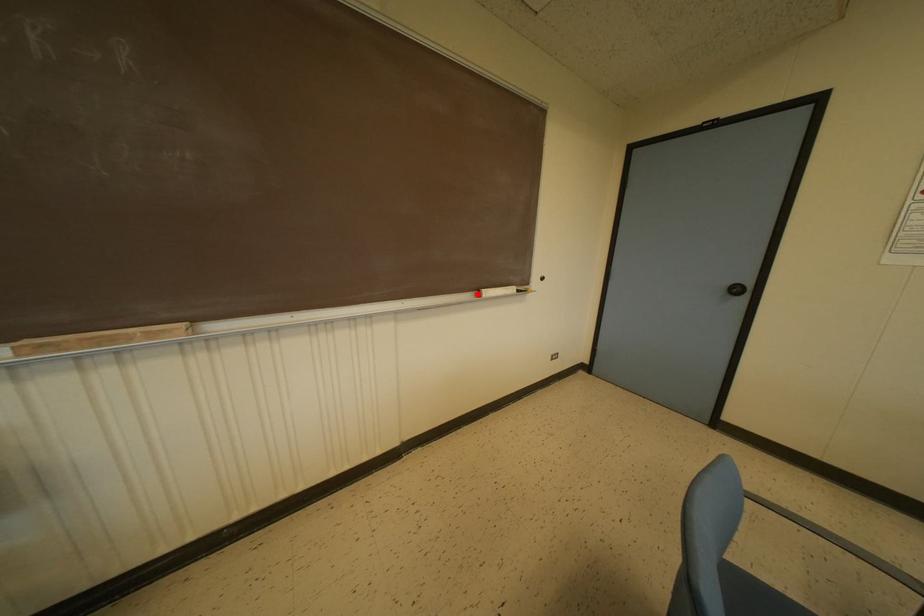
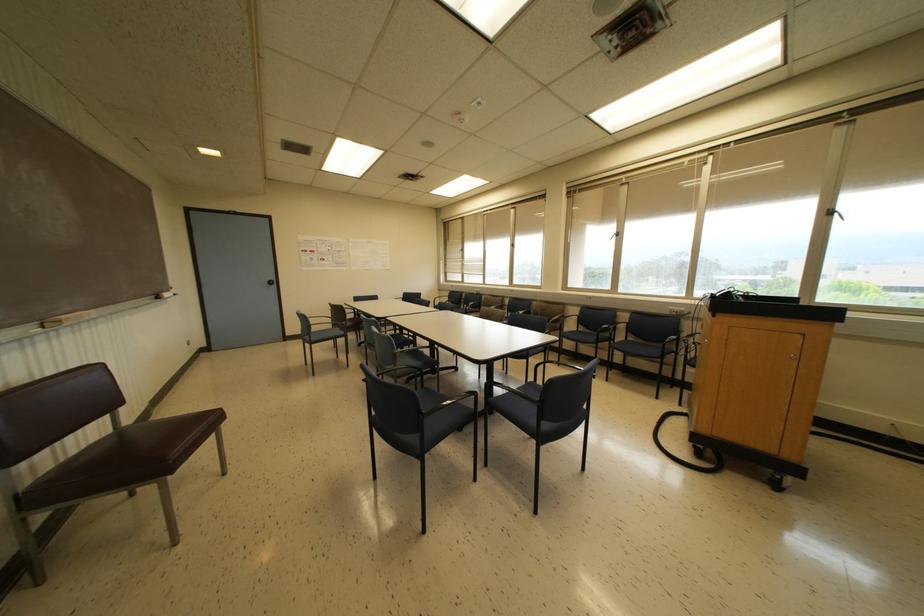
The point at the highlighted location is marked in the first image. Where is the corresponding point in the second image?

(157, 297)